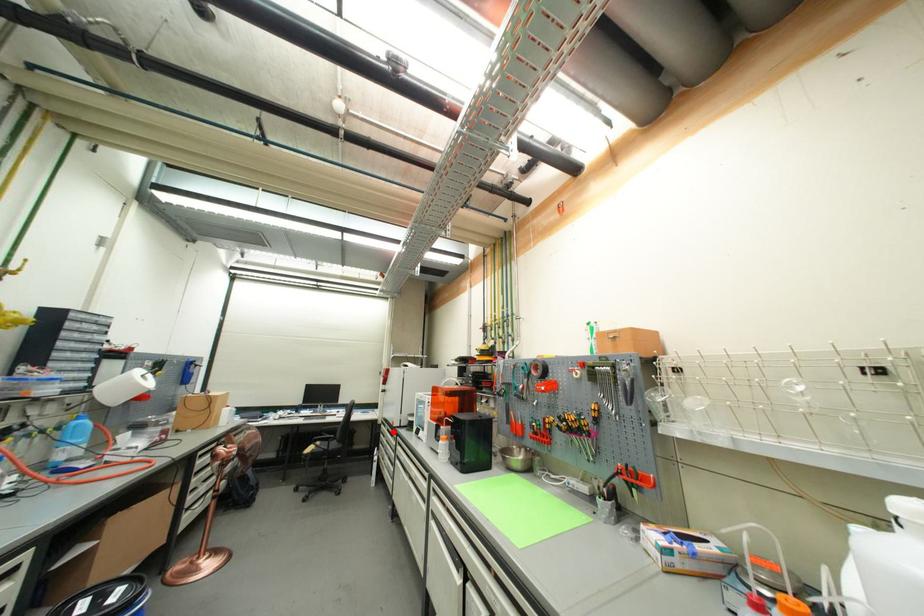
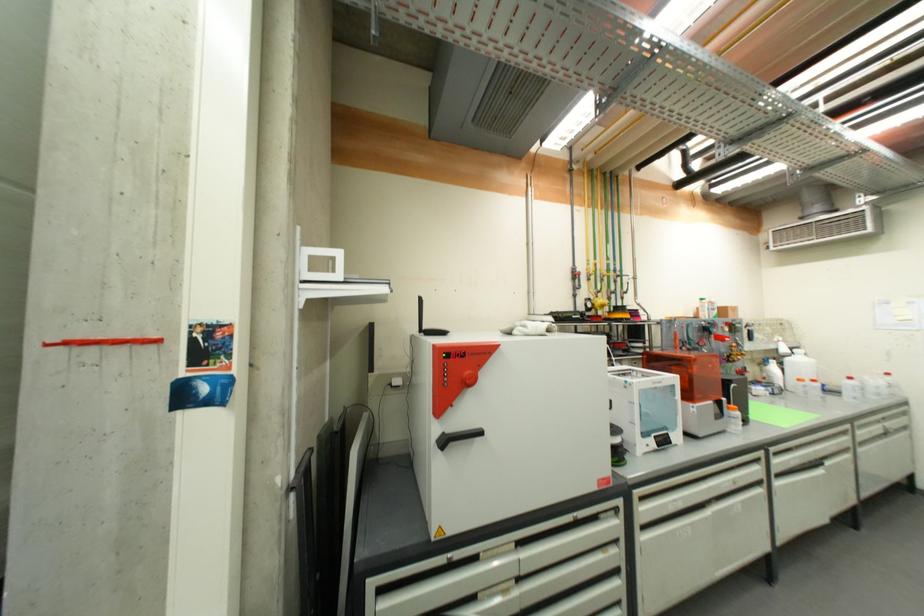
The point at the highlighted location is marked in the first image. Where is the corresponding point in the second image?

(525, 546)